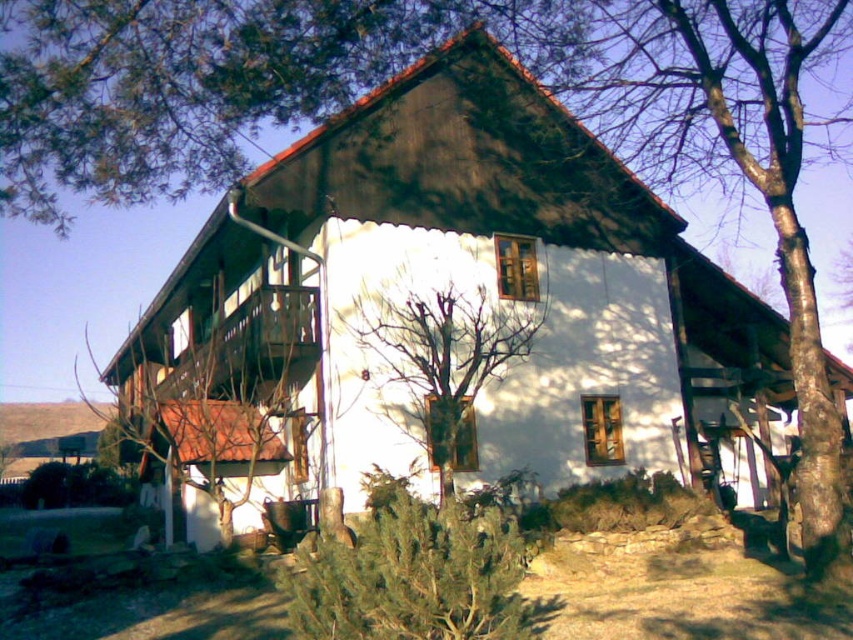
Who is positioned more to the right, white matte house at center or bare branches at center?

Positioned to the right is bare branches at center.

Is point (480, 29) behind point (463, 348)?

Yes, it is.

At what (x,y) coordinates should I click in order to perform the action: click on white matte house at center. Please return your answer as a coordinate pair (x, y). This screenshot has height=640, width=853. Looking at the image, I should click on (451, 289).

Locate an element on the screen. The image size is (853, 640). white matte house at center is located at coordinates (451, 289).

What do you see at coordinates (451, 289) in the screenshot?
I see `white matte house at center` at bounding box center [451, 289].

Which is behind, point (376, 88) or point (432, 595)?

The point (376, 88) is more distant.

Find the location of a particular element. The image size is (853, 640). white matte house at center is located at coordinates (451, 289).

Is green textured bush at lower center thinner than bare branches at center?

Indeed, green textured bush at lower center has a lesser width compared to bare branches at center.

How much distance is there between green textured bush at lower center and bare branches at center?

green textured bush at lower center and bare branches at center are 6.93 meters apart from each other.

Does point (389, 484) come in front of point (457, 417)?

No.

Locate an element on the screen. green textured bush at lower center is located at coordinates (413, 573).